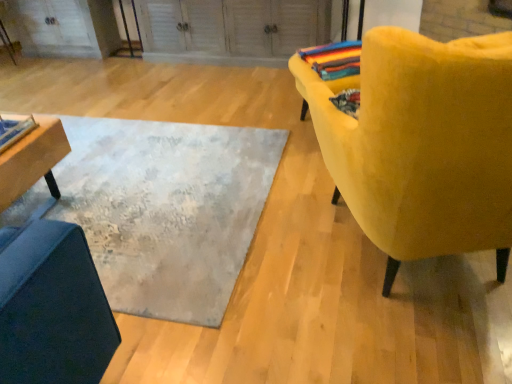
Question: Considering the relative positions of multicolored woven blanket at upper right and wooden table at left in the image provided, is multicolored woven blanket at upper right behind wooden table at left?

Choices:
 (A) no
 (B) yes

Answer: (B)

Question: Considering the relative sizes of multicolored woven blanket at upper right and wooden table at left in the image provided, is multicolored woven blanket at upper right shorter than wooden table at left?

Choices:
 (A) no
 (B) yes

Answer: (B)

Question: Would you say multicolored woven blanket at upper right contains wooden table at left?

Choices:
 (A) yes
 (B) no

Answer: (B)

Question: Is multicolored woven blanket at upper right thinner than wooden table at left?

Choices:
 (A) no
 (B) yes

Answer: (B)

Question: Is multicolored woven blanket at upper right to the left of wooden table at left from the viewer's perspective?

Choices:
 (A) yes
 (B) no

Answer: (B)

Question: Looking at their shapes, would you say textured gray rug at center is wider or thinner than wooden table at left?

Choices:
 (A) thin
 (B) wide

Answer: (B)

Question: From the image's perspective, is textured gray rug at center located above or below wooden table at left?

Choices:
 (A) above
 (B) below

Answer: (A)

Question: Considering the positions of textured gray rug at center and wooden table at left in the image, is textured gray rug at center bigger or smaller than wooden table at left?

Choices:
 (A) big
 (B) small

Answer: (A)

Question: In the image, is textured gray rug at center positioned in front of or behind wooden table at left?

Choices:
 (A) front
 (B) behind

Answer: (A)

Question: Looking at their shapes, would you say textured gray rug at center is wider or thinner than multicolored woven blanket at upper right?

Choices:
 (A) wide
 (B) thin

Answer: (A)

Question: Visually, is textured gray rug at center positioned to the left or to the right of multicolored woven blanket at upper right?

Choices:
 (A) left
 (B) right

Answer: (A)

Question: From a real-world perspective, is textured gray rug at center above or below multicolored woven blanket at upper right?

Choices:
 (A) above
 (B) below

Answer: (B)

Question: Choose the correct answer: Is textured gray rug at center inside multicolored woven blanket at upper right or outside it?

Choices:
 (A) inside
 (B) outside

Answer: (B)

Question: Relative to velvet yellow chair at right, is wooden table at left in front or behind?

Choices:
 (A) behind
 (B) front

Answer: (A)

Question: Considering the positions of point (10, 158) and point (507, 168), is point (10, 158) closer or farther from the camera than point (507, 168)?

Choices:
 (A) farther
 (B) closer

Answer: (A)